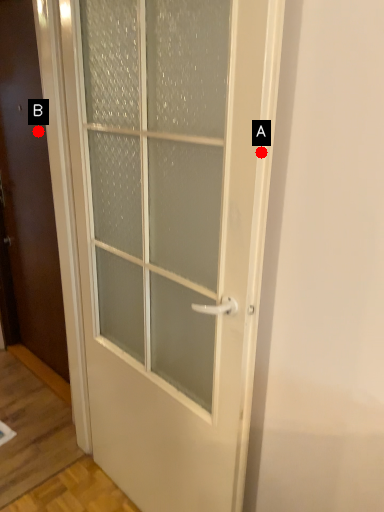
Question: Two points are circled on the image, labeled by A and B beside each circle. Among these points, which one is nearest to the camera?

Choices:
 (A) A is closer
 (B) B is closer

Answer: (A)